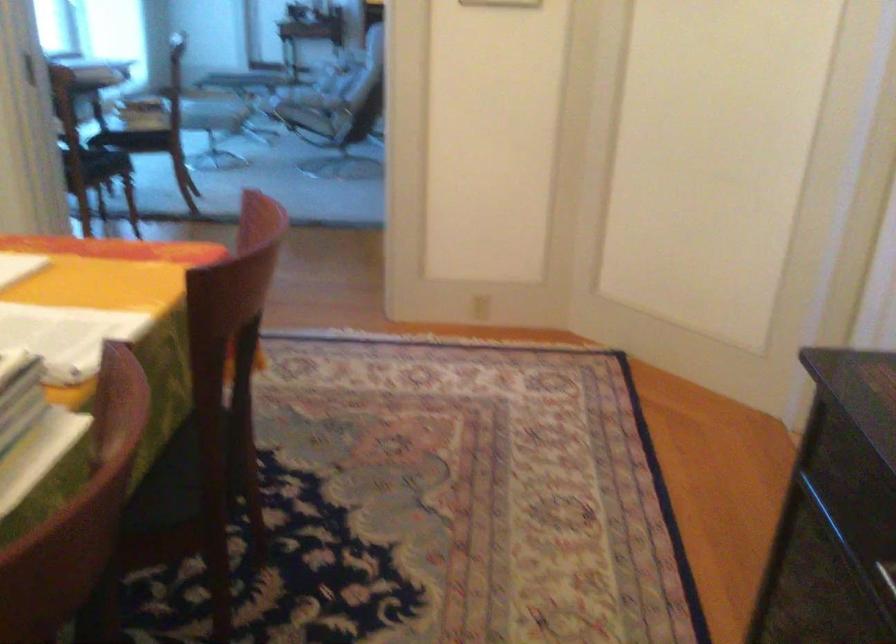
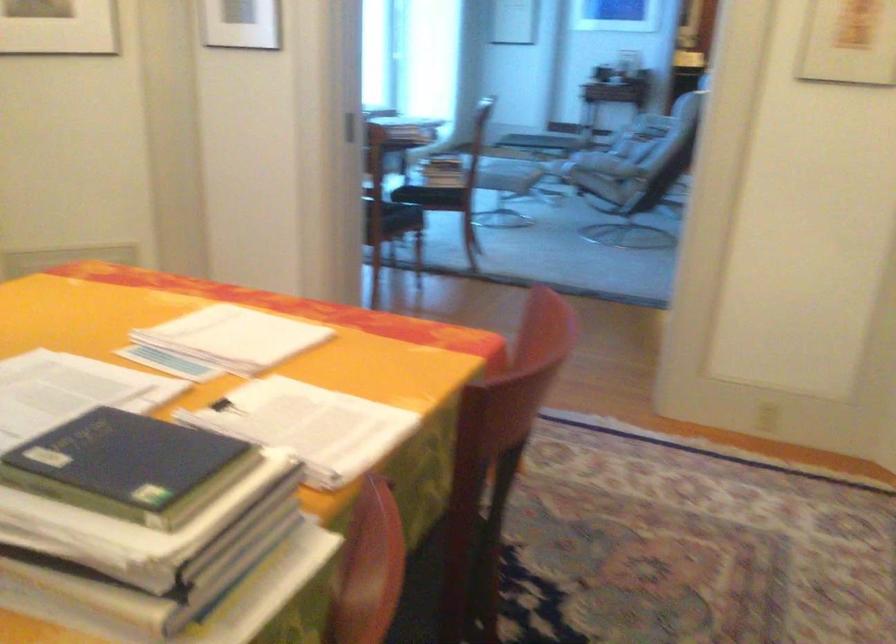
Locate, in the second image, the point that corresponds to pixel 309 98 in the first image.

(604, 165)